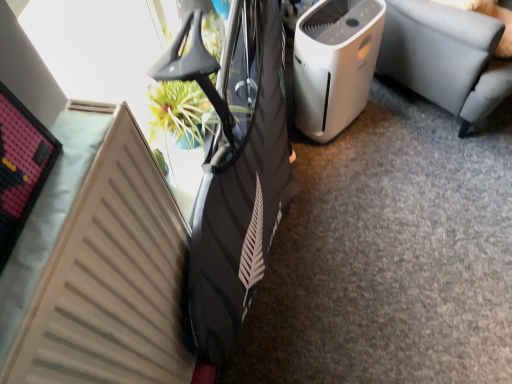
Question: From a real-world perspective, is white plastic air purifier at center-right positioned under white plastic air purifier at center right based on gravity?

Choices:
 (A) yes
 (B) no

Answer: (A)

Question: Is white plastic air purifier at center-right to the right of white plastic air purifier at center right from the viewer's perspective?

Choices:
 (A) yes
 (B) no

Answer: (B)

Question: Is white plastic air purifier at center-right facing towards white plastic air purifier at center right?

Choices:
 (A) yes
 (B) no

Answer: (B)

Question: Is white plastic air purifier at center right at the back of white plastic air purifier at center-right?

Choices:
 (A) yes
 (B) no

Answer: (B)

Question: Does white plastic air purifier at center-right have a lesser width compared to white plastic air purifier at center right?

Choices:
 (A) yes
 (B) no

Answer: (A)

Question: Does white plastic air purifier at center-right come in front of white plastic air purifier at center right?

Choices:
 (A) yes
 (B) no

Answer: (B)

Question: Is white plastic air purifier at center right at the right side of beige matte radiator at lower left?

Choices:
 (A) yes
 (B) no

Answer: (A)

Question: Is the depth of white plastic air purifier at center right less than that of beige matte radiator at lower left?

Choices:
 (A) yes
 (B) no

Answer: (B)

Question: Could you tell me if white plastic air purifier at center right is turned towards beige matte radiator at lower left?

Choices:
 (A) no
 (B) yes

Answer: (A)

Question: From the image's perspective, is white plastic air purifier at center right on beige matte radiator at lower left?

Choices:
 (A) no
 (B) yes

Answer: (B)

Question: From the image's perspective, is white plastic air purifier at center right located beneath beige matte radiator at lower left?

Choices:
 (A) no
 (B) yes

Answer: (A)

Question: Is white plastic air purifier at center right taller than beige matte radiator at lower left?

Choices:
 (A) no
 (B) yes

Answer: (A)

Question: Considering the relative sizes of beige matte radiator at lower left and white plastic air purifier at center-right in the image provided, is beige matte radiator at lower left bigger than white plastic air purifier at center-right?

Choices:
 (A) no
 (B) yes

Answer: (B)